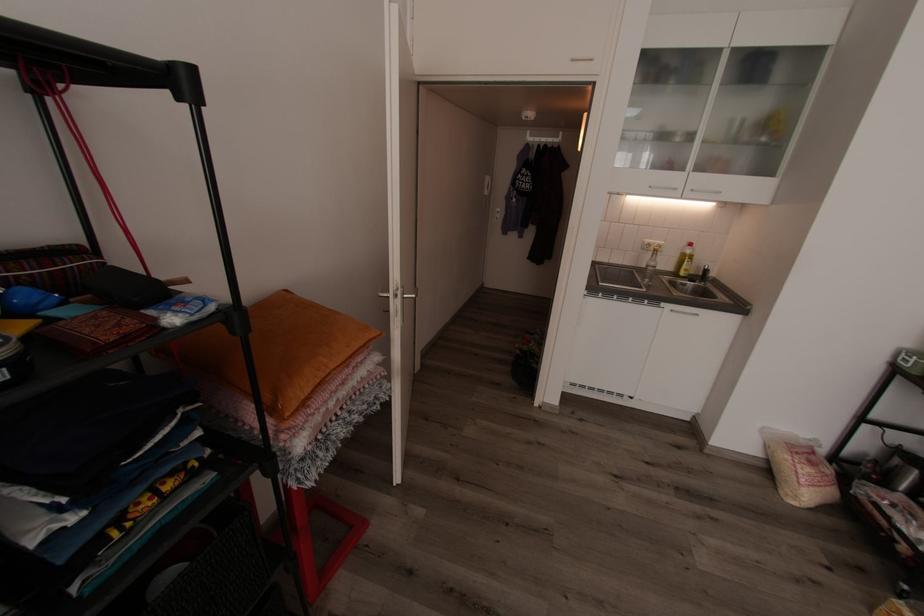
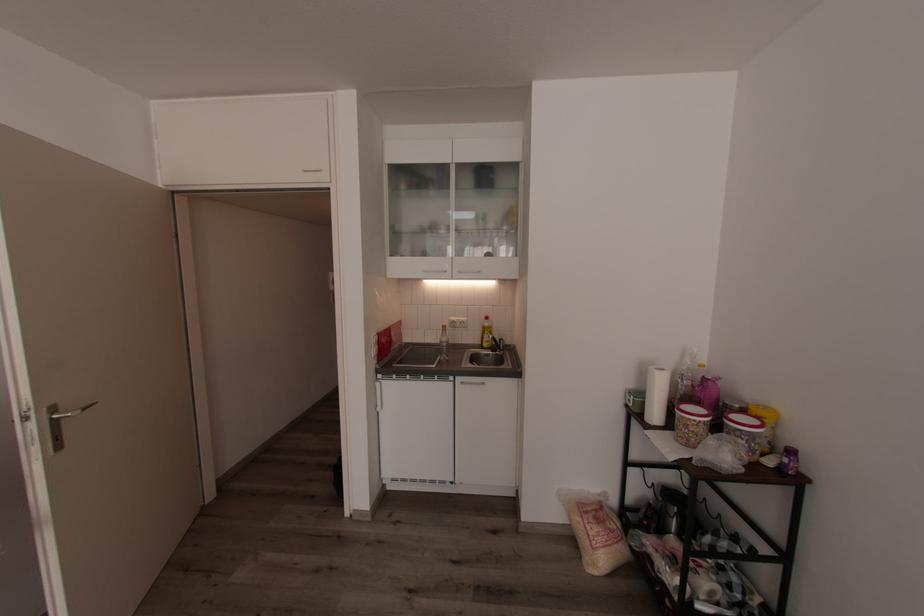
Where in the second image is the point corresponding to (x=805, y=471) from the first image?

(594, 533)